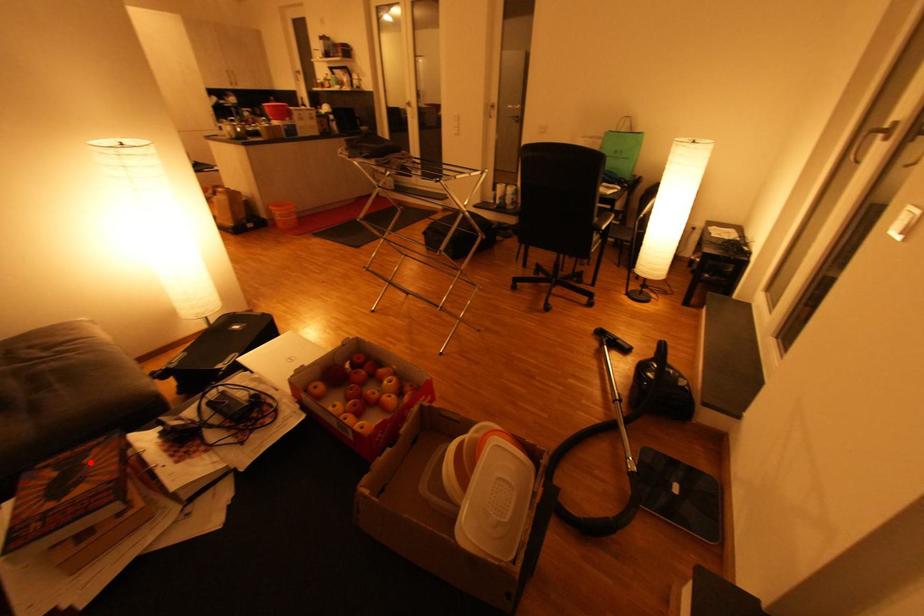
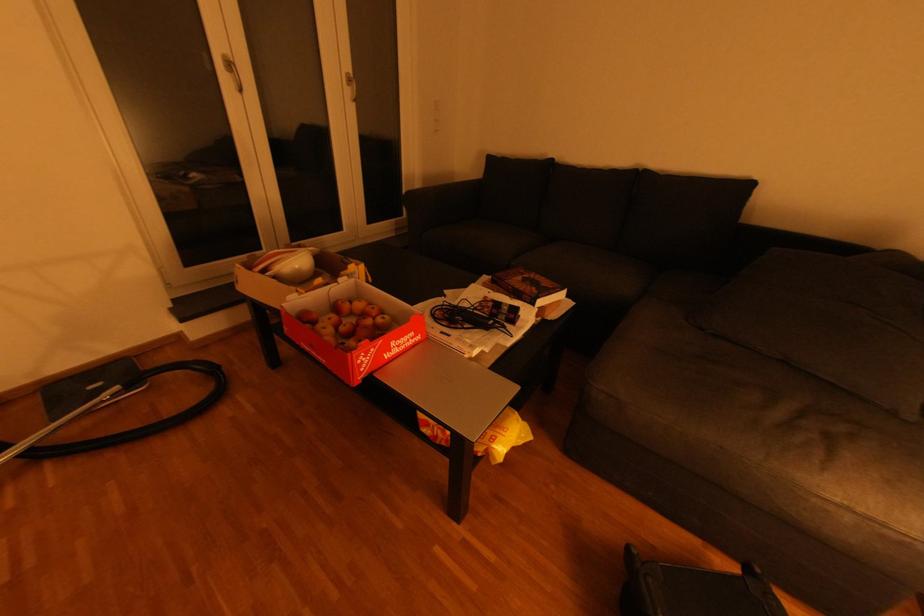
Question: I am providing you with two images of the same scene from different viewpoints. In image1, a red point is highlighted. Considering the same 3D point in image2, which of the following is correct?

Choices:
 (A) It is closer
 (B) It is farther

Answer: (B)